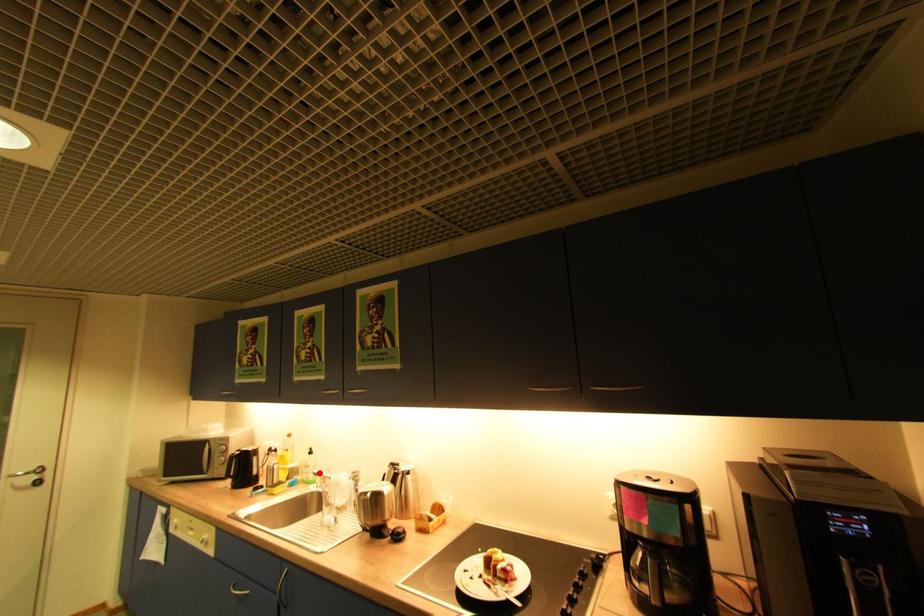
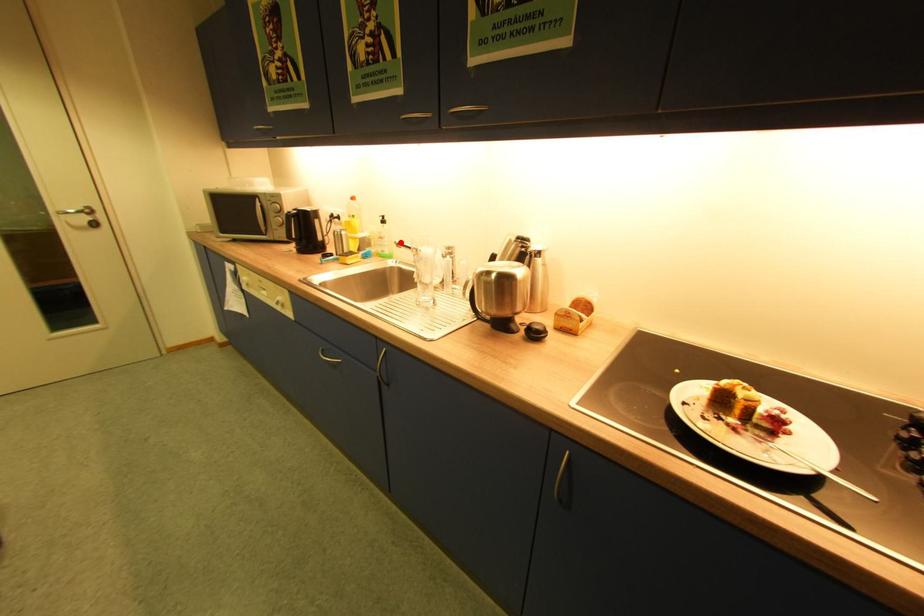
I am providing you with two images of the same scene from different viewpoints. A red point is marked on the first image and another point is marked on the second image. Is the red point in image1 aligned with the point shown in image2?

Yes